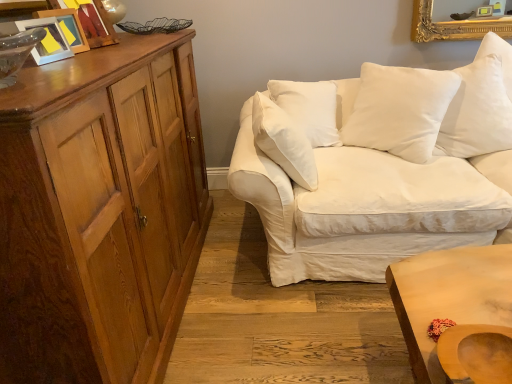
Identify the location of matte plastic picture frame at upper left, the 3th picture frame viewed from the back. This screenshot has height=384, width=512. (47, 40).

This screenshot has width=512, height=384. Describe the element at coordinates (399, 110) in the screenshot. I see `white cotton pillow at upper right, arranged as the 1th pillow when viewed from the left` at that location.

Describe the element at coordinates (93, 22) in the screenshot. I see `wooden picture frame at upper left, acting as the 3th picture frame starting from the front` at that location.

This screenshot has height=384, width=512. What are the coordinates of `wooden picture frame at upper left, the first picture frame positioned from the back` in the screenshot? It's located at (93, 22).

Where is `white cotton couch at right`? The height and width of the screenshot is (384, 512). white cotton couch at right is located at coordinates (378, 166).

Find the location of a particular element. This screenshot has width=512, height=384. wooden picture frame at upper left, positioned as the second picture frame in back-to-front order is located at coordinates (68, 27).

Where is `matte plastic picture frame at upper left, the 3th picture frame viewed from the back`? This screenshot has height=384, width=512. matte plastic picture frame at upper left, the 3th picture frame viewed from the back is located at coordinates (47, 40).

Which object is positioned more to the right, white cotton pillow at upper right, placed as the 1th pillow when sorted from right to left, or shiny brown cabinet at left?

white cotton pillow at upper right, placed as the 1th pillow when sorted from right to left, is more to the right.

In order to click on the 2nd pillow behind when counting from the shiny brown cabinet at left in this screenshot , I will do `click(477, 113)`.

From a real-world perspective, is white cotton pillow at upper right, placed as the 1th pillow when sorted from right to left, below shiny brown cabinet at left?

No.

Is shiny brown cabinet at left in front of or behind white cotton couch at right in the image?

shiny brown cabinet at left is positioned closer to the viewer than white cotton couch at right.

Which of these two, shiny brown cabinet at left or white cotton couch at right, is bigger?

Bigger between the two is white cotton couch at right.

Which is less distant, (x=126, y=289) or (x=464, y=155)?

The point (x=126, y=289) is more forward.

Is there a large distance between white cotton couch at right and wooden picture frame at upper left, the first picture frame positioned from the back?

white cotton couch at right is far away from wooden picture frame at upper left, the first picture frame positioned from the back.

Which of these two, white cotton couch at right or wooden picture frame at upper left, acting as the 3th picture frame starting from the front, stands shorter?

Standing shorter between the two is wooden picture frame at upper left, acting as the 3th picture frame starting from the front.

Which is behind, point (441, 237) or point (74, 3)?

The point (441, 237) is more distant.

Is white cotton couch at right positioned with its back to wooden picture frame at upper left, the first picture frame positioned from the back?

No, white cotton couch at right is not facing away from wooden picture frame at upper left, the first picture frame positioned from the back.

Is white cotton pillow at upper right, marked as the second pillow in a right-to-left arrangement, at the left side of shiny brown cabinet at left?

In fact, white cotton pillow at upper right, marked as the second pillow in a right-to-left arrangement, is to the right of shiny brown cabinet at left.

From the image's perspective, relative to shiny brown cabinet at left, is white cotton pillow at upper right, marked as the second pillow in a right-to-left arrangement, above or below?

Clearly, from the image's perspective, white cotton pillow at upper right, marked as the second pillow in a right-to-left arrangement, is above shiny brown cabinet at left.

Is white cotton pillow at upper right, marked as the second pillow in a right-to-left arrangement, wider or thinner than shiny brown cabinet at left?

In the image, white cotton pillow at upper right, marked as the second pillow in a right-to-left arrangement, appears to be more narrow than shiny brown cabinet at left.

Looking at the image, does white cotton pillow at upper right, marked as the second pillow in a right-to-left arrangement, seem bigger or smaller compared to shiny brown cabinet at left?

In the image, white cotton pillow at upper right, marked as the second pillow in a right-to-left arrangement, appears to be smaller than shiny brown cabinet at left.

From a real-world perspective, is matte plastic picture frame at upper left, the 3th picture frame viewed from the back, located beneath wooden swivel chair at lower right?

No.

Is wooden swivel chair at lower right surrounded by matte plastic picture frame at upper left, arranged as the first picture frame when viewed from the front?

No, wooden swivel chair at lower right is located outside of matte plastic picture frame at upper left, arranged as the first picture frame when viewed from the front.

Can you confirm if matte plastic picture frame at upper left, the 3th picture frame viewed from the back, is bigger than wooden swivel chair at lower right?

No.

Looking at this image, how many degrees apart are the facing directions of matte plastic picture frame at upper left, the 3th picture frame viewed from the back, and wooden swivel chair at lower right?

matte plastic picture frame at upper left, the 3th picture frame viewed from the back, and wooden swivel chair at lower right are facing 79.4 degrees away from each other.

Can you confirm if white cotton couch at right is positioned to the right of light brown wooden table at lower right?

Yes.

Considering the sizes of objects white cotton couch at right and light brown wooden table at lower right in the image provided, who is thinner, white cotton couch at right or light brown wooden table at lower right?

With smaller width is light brown wooden table at lower right.

Is white cotton couch at right facing away from light brown wooden table at lower right?

white cotton couch at right is not turned away from light brown wooden table at lower right.

From a real-world perspective, is white cotton couch at right positioned under light brown wooden table at lower right based on gravity?

No, from a real-world perspective, white cotton couch at right is not under light brown wooden table at lower right.

Looking at this image, is wooden picture frame at upper left, positioned as the second picture frame in back-to-front order, in front of or behind shiny brown cabinet at left in the image?

wooden picture frame at upper left, positioned as the second picture frame in back-to-front order, is behind shiny brown cabinet at left.

From the image's perspective, which is above, wooden picture frame at upper left, positioned as the second picture frame in back-to-front order, or shiny brown cabinet at left?

wooden picture frame at upper left, positioned as the second picture frame in back-to-front order, from the image's perspective.

What's the angular difference between wooden picture frame at upper left, the second picture frame when ordered from front to back, and shiny brown cabinet at left's facing directions?

They differ by 10.6 degrees in their facing directions.

Is wooden picture frame at upper left, the second picture frame when ordered from front to back, spatially inside shiny brown cabinet at left, or outside of it?

wooden picture frame at upper left, the second picture frame when ordered from front to back, exists outside the volume of shiny brown cabinet at left.

Locate an element on the screen. cabinetry on the left of white cotton pillow at upper right, placed as the 1th pillow when sorted from right to left is located at coordinates (100, 212).

Image resolution: width=512 pixels, height=384 pixels. I want to click on studio couch on the right side of shiny brown cabinet at left, so click(x=378, y=166).

Considering their positions, is wooden swivel chair at lower right positioned closer to light brown wooden table at lower right than wooden picture frame at upper left, the first picture frame positioned from the back?

wooden swivel chair at lower right is positioned closer to the anchor light brown wooden table at lower right.

Which object lies further to the anchor point matte plastic picture frame at upper left, the 3th picture frame viewed from the back, wooden picture frame at upper left, positioned as the second picture frame in back-to-front order, or shiny brown cabinet at left?

shiny brown cabinet at left.

Estimate the real-world distances between objects in this image. Which object is closer to light brown wooden table at lower right, white cotton pillow at upper right, placed as the 1th pillow when sorted from right to left, or matte plastic picture frame at upper left, arranged as the first picture frame when viewed from the front?

white cotton pillow at upper right, placed as the 1th pillow when sorted from right to left, is closer to light brown wooden table at lower right.

When comparing their distances from wooden picture frame at upper left, acting as the 3th picture frame starting from the front, does shiny brown cabinet at left or matte plastic picture frame at upper left, arranged as the first picture frame when viewed from the front, seem closer?

matte plastic picture frame at upper left, arranged as the first picture frame when viewed from the front, is positioned closer to the anchor wooden picture frame at upper left, acting as the 3th picture frame starting from the front.

When comparing their distances from wooden picture frame at upper left, the first picture frame positioned from the back, does light brown wooden table at lower right or shiny brown cabinet at left seem closer?

Based on the image, shiny brown cabinet at left appears to be nearer to wooden picture frame at upper left, the first picture frame positioned from the back.

Looking at the image, which one is located further to shiny brown cabinet at left, light brown wooden table at lower right or matte plastic picture frame at upper left, arranged as the first picture frame when viewed from the front?

light brown wooden table at lower right lies further to shiny brown cabinet at left than the other object.

Looking at the image, which one is located closer to light brown wooden table at lower right, shiny brown cabinet at left or white cotton pillow at upper right, marked as the second pillow in a right-to-left arrangement?

white cotton pillow at upper right, marked as the second pillow in a right-to-left arrangement, lies closer to light brown wooden table at lower right than the other object.

Which object lies nearer to the anchor point white cotton couch at right, wooden picture frame at upper left, acting as the 3th picture frame starting from the front, or white cotton pillow at upper right, arranged as the 1th pillow when viewed from the left?

Based on the image, white cotton pillow at upper right, arranged as the 1th pillow when viewed from the left, appears to be nearer to white cotton couch at right.

Locate an element on the screen. swivel chair between matte plastic picture frame at upper left, arranged as the first picture frame when viewed from the front, and white cotton couch at right from left to right is located at coordinates (476, 353).

This screenshot has width=512, height=384. What are the coordinates of `pillow between wooden picture frame at upper left, the first picture frame positioned from the back, and white cotton couch at right from left to right` in the screenshot? It's located at (399, 110).

What are the coordinates of `cabinetry between matte plastic picture frame at upper left, arranged as the first picture frame when viewed from the front, and light brown wooden table at lower right, in the horizontal direction` in the screenshot? It's located at (100, 212).

Where is `table situated between wooden picture frame at upper left, positioned as the second picture frame in back-to-front order, and white cotton couch at right from left to right`? This screenshot has height=384, width=512. table situated between wooden picture frame at upper left, positioned as the second picture frame in back-to-front order, and white cotton couch at right from left to right is located at coordinates (449, 299).